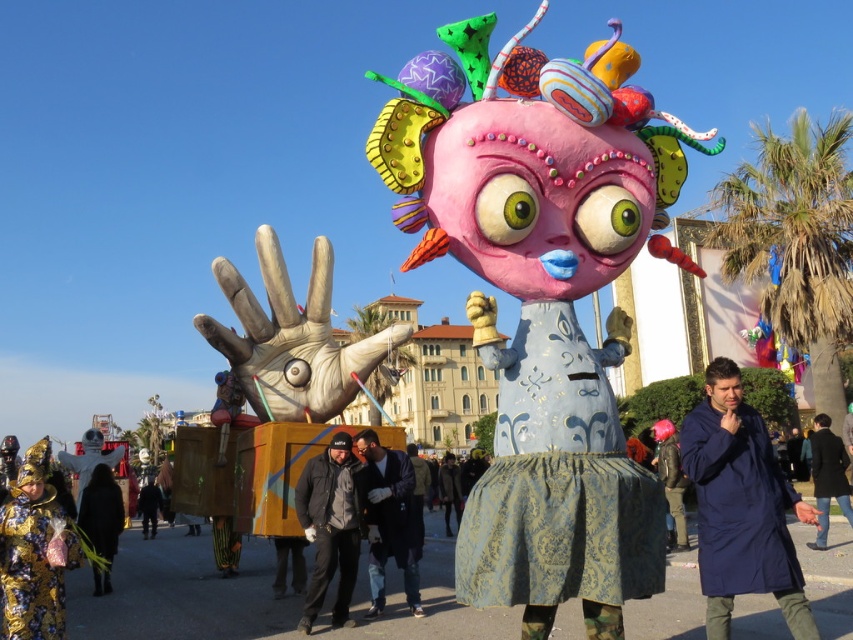
Who is shorter, black fabric at lower left or pink fabric umbrella at upper center?

pink fabric umbrella at upper center is shorter.

Is the position of black fabric at lower left less distant than that of pink fabric umbrella at upper center?

Yes.

Is point (102, 477) farther from camera compared to point (659, 440)?

No, (102, 477) is closer to viewer.

This screenshot has width=853, height=640. In order to click on black fabric at lower left in this screenshot , I will do `click(102, 522)`.

At what (x,y) coordinates should I click in order to perform the action: click on gold metallic mask at lower left. Please return your answer as a coordinate pair (x, y). This screenshot has height=640, width=853. Looking at the image, I should click on (33, 552).

Is gold metallic mask at lower left to the right of pink fabric umbrella at upper center from the viewer's perspective?

In fact, gold metallic mask at lower left is to the left of pink fabric umbrella at upper center.

Between point (20, 518) and point (669, 436), which one is positioned in front?

Point (20, 518)

The height and width of the screenshot is (640, 853). I want to click on gold metallic mask at lower left, so click(33, 552).

In the scene shown: Between black fabric jacket at center and black fabric at lower left, which one is positioned lower?

black fabric at lower left is below.

This screenshot has height=640, width=853. Describe the element at coordinates (331, 525) in the screenshot. I see `black fabric jacket at center` at that location.

Is point (328, 486) closer to camera compared to point (97, 532)?

Yes, point (328, 486) is closer to viewer.

You are a GUI agent. You are given a task and a screenshot of the screen. Output one action in this format:
    pyautogui.click(x=<x>, y=<y>)
    Task: Click on the black fabric jacket at center
    The height and width of the screenshot is (640, 853).
    Given the screenshot: What is the action you would take?
    pyautogui.click(x=331, y=525)